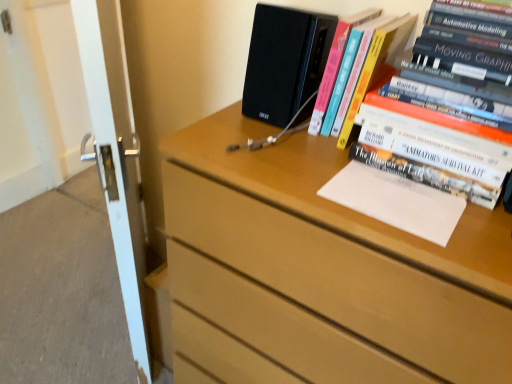
At what (x,y) coordinates should I click in order to perform the action: click on empty space that is ontop of wooden chest of drawers at upper right. Please return your answer as a coordinate pair (x, y). Looking at the image, I should click on click(355, 178).